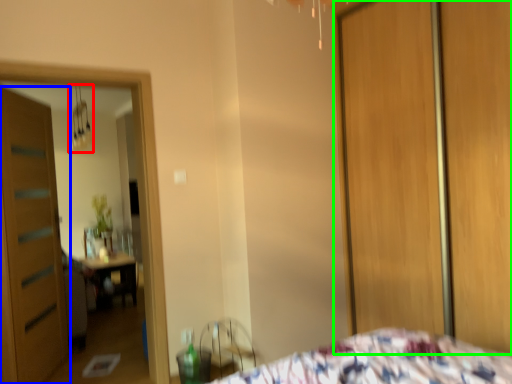
Question: Based on their relative distances, which object is farther from light fixture (highlighted by a red box)? Choose from door (highlighted by a blue box) and screen door (highlighted by a green box).

Choices:
 (A) door
 (B) screen door

Answer: (B)